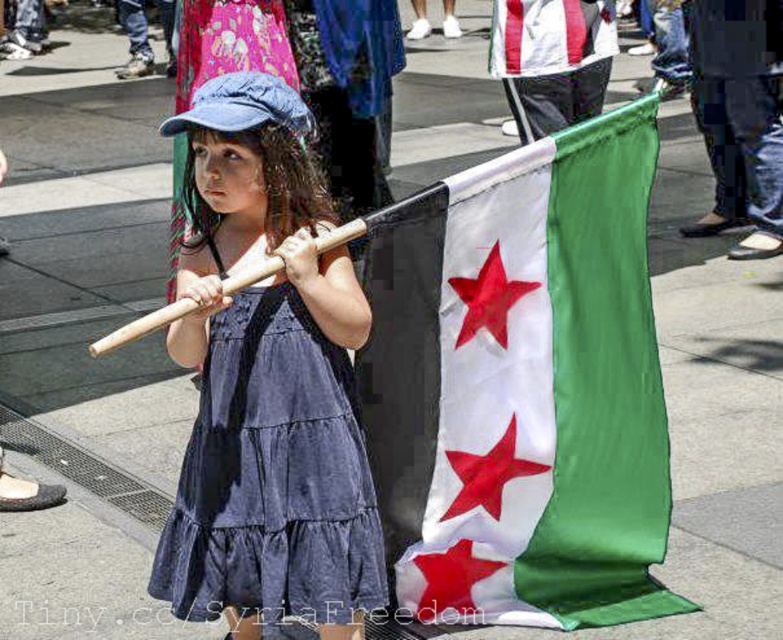
Question: Which object appears closest to the camera in this image?

Choices:
 (A) denim dress at center
 (B) silky fabric flag at center

Answer: (A)

Question: Is silky fabric flag at center closer to camera compared to denim dress at center?

Choices:
 (A) no
 (B) yes

Answer: (A)

Question: Observing the image, what is the correct spatial positioning of silky fabric flag at center in reference to denim dress at center?

Choices:
 (A) below
 (B) above

Answer: (B)

Question: Does silky fabric flag at center appear over denim dress at center?

Choices:
 (A) no
 (B) yes

Answer: (B)

Question: Which point is farther to the camera?

Choices:
 (A) silky fabric flag at center
 (B) denim dress at center

Answer: (A)